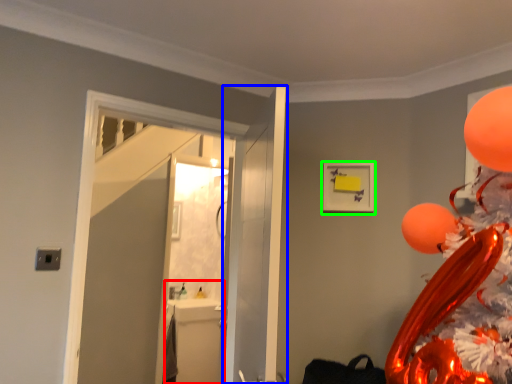
Question: Which object is the farthest from sink (highlighted by a red box)? Choose among these: door (highlighted by a blue box) or picture frame (highlighted by a green box).

Choices:
 (A) door
 (B) picture frame

Answer: (B)